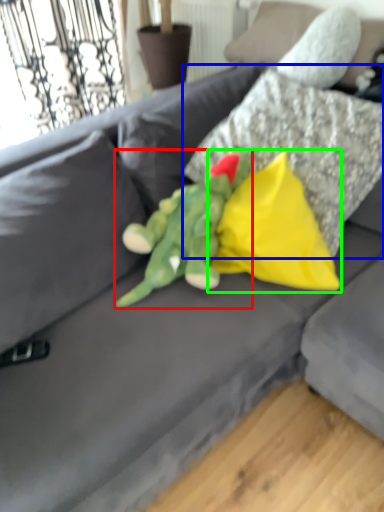
Question: Estimate the real-world distances between objects in this image. Which object is closer to toy (highlighted by a red box), pillow (highlighted by a blue box) or pillow (highlighted by a green box)?

Choices:
 (A) pillow
 (B) pillow

Answer: (B)